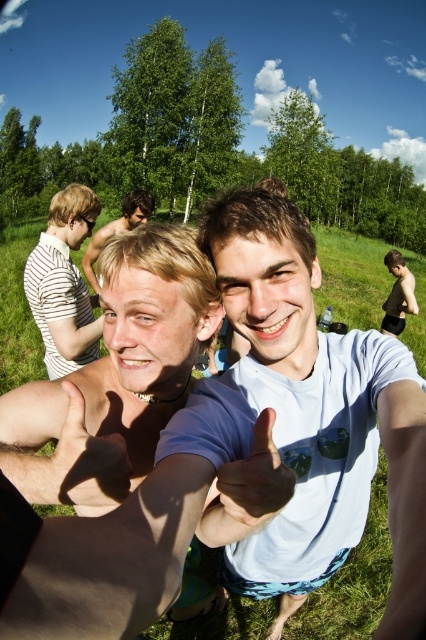
Does blonde hair at center appear on the left side of matte black tank top at center?

Yes, blonde hair at center is to the left of matte black tank top at center.

Does blonde hair at center have a larger size compared to matte black tank top at center?

Actually, blonde hair at center might be smaller than matte black tank top at center.

Does point (137, 218) come farther from viewer compared to point (399, 284)?

No.

The width and height of the screenshot is (426, 640). What are the coordinates of `blonde hair at center` in the screenshot? It's located at (117, 228).

Who is lower down, green grass at center or smooth skin hand at center?

smooth skin hand at center is below.

Who is taller, green grass at center or smooth skin hand at center?

green grass at center

At what (x,y) coordinates should I click in order to perform the action: click on green grass at center. Please return your answer as a coordinate pair (x, y). The height and width of the screenshot is (640, 426). Looking at the image, I should click on (353, 584).

Image resolution: width=426 pixels, height=640 pixels. Identify the location of green grass at center. (353, 584).

Which is more to the right, striped fabric shirt at left or smooth skin hand at center?

smooth skin hand at center is more to the right.

Describe the element at coordinates (63, 284) in the screenshot. I see `striped fabric shirt at left` at that location.

Between point (92, 310) and point (121, 483), which one is positioned in front?

Point (121, 483) is in front.

Image resolution: width=426 pixels, height=640 pixels. Identify the location of striped fabric shirt at left. (63, 284).